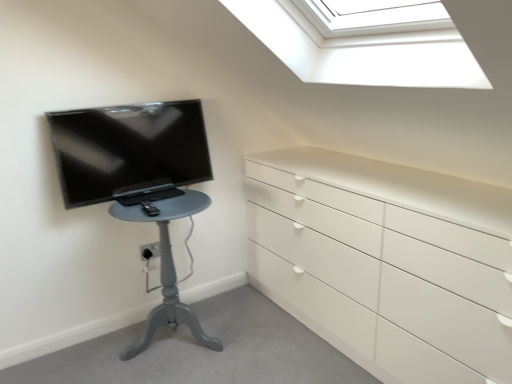
What do you see at coordinates (129, 152) in the screenshot?
I see `matte black tv at left` at bounding box center [129, 152].

In order to face matte black tv at left, should I rotate leftwards or rightwards?

You should look left and rotate roughly 15.384 degrees.

The height and width of the screenshot is (384, 512). I want to click on matte black tv at left, so click(x=129, y=152).

Describe the element at coordinates (166, 259) in the screenshot. I see `matte gray table at left` at that location.

Measure the distance between point (136, 213) and camera.

Point (136, 213) and camera are 6.64 feet apart.

The width and height of the screenshot is (512, 384). What are the coordinates of `matte gray table at left` in the screenshot? It's located at (166, 259).

Identify the location of matte black tv at left. This screenshot has height=384, width=512. (129, 152).

Which is more to the left, matte black tv at left or matte gray table at left?

matte black tv at left is more to the left.

Is matte black tv at left positioned in front of matte gray table at left?

No, matte black tv at left is behind matte gray table at left.

Is point (61, 129) closer or farther from the camera than point (168, 308)?

Point (61, 129) is closer to the camera than point (168, 308).

From the image's perspective, which one is positioned lower, matte black tv at left or matte gray table at left?

matte gray table at left.

From a real-world perspective, is matte black tv at left physically above matte gray table at left?

Yes.

In the scene shown: In terms of width, does matte black tv at left look wider or thinner when compared to matte gray table at left?

Considering their sizes, matte black tv at left looks slimmer than matte gray table at left.

Who is taller, matte black tv at left or matte gray table at left?

Standing taller between the two is matte gray table at left.

Does matte black tv at left have a larger size compared to matte gray table at left?

Actually, matte black tv at left might be smaller than matte gray table at left.

Is matte gray table at left inside matte black tv at left?

No, matte gray table at left is not inside matte black tv at left.

Would you consider matte black tv at left to be distant from matte gray table at left?

matte black tv at left is near matte gray table at left, not far away.

Could you tell me if matte black tv at left is turned towards matte gray table at left?

No, matte black tv at left is not oriented towards matte gray table at left.

How different are the orientations of matte black tv at left and matte gray table at left in degrees?

0.119 degrees.

You are a GUI agent. You are given a task and a screenshot of the screen. Output one action in this format:
    pyautogui.click(x=<x>, y=<y>)
    Task: Click on the furniture below the matte black tv at left (from the image's perspective)
    
    Given the screenshot: What is the action you would take?
    pyautogui.click(x=166, y=259)

Can you confirm if matte gray table at left is positioned to the right of matte black tv at left?

Yes.

Which object is closer to the camera taking this photo, matte gray table at left or matte black tv at left?

matte gray table at left is closer to the camera.

Which is less distant, (201,204) or (186,140)?

Point (201,204) is closer to the camera than point (186,140).

From the image's perspective, which is below, matte gray table at left or matte black tv at left?

matte gray table at left is shown below in the image.

From the picture: From a real-world perspective, who is located higher, matte gray table at left or matte black tv at left?

matte black tv at left is physically above.

Can you confirm if matte gray table at left is thinner than matte black tv at left?

No.

Between matte gray table at left and matte black tv at left, which one has more height?

matte gray table at left.

Considering the sizes of objects matte gray table at left and matte black tv at left in the image provided, who is bigger, matte gray table at left or matte black tv at left?

matte gray table at left is bigger.

Does matte gray table at left contain matte black tv at left?

No.

Are matte gray table at left and matte black tv at left beside each other?

No, matte gray table at left is not making contact with matte black tv at left.

Does matte gray table at left turn towards matte black tv at left?

No.

How many degrees apart are the facing directions of matte gray table at left and matte black tv at left?

The angle between the facing direction of matte gray table at left and the facing direction of matte black tv at left is 0.119 degrees.

How far apart are matte gray table at left and matte black tv at left?

matte gray table at left is 10.49 inches from matte black tv at left.

Where is `television above the matte gray table at left (from a real-world perspective)`? television above the matte gray table at left (from a real-world perspective) is located at coordinates (129, 152).

Identify the location of furniture below the matte black tv at left (from the image's perspective). (166, 259).

Identify the location of television on the left of the matte gray table at left. (129, 152).